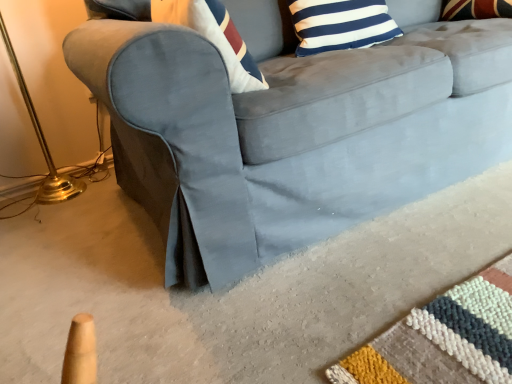
I want to click on blank area beneath gold metallic table lamp at left (from a real-world perspective), so click(x=87, y=200).